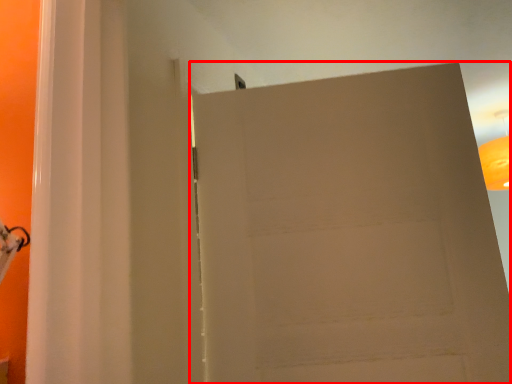
Question: Observing the image, what is the correct spatial positioning of door (annotated by the red box) in reference to lamp?

Choices:
 (A) left
 (B) right

Answer: (A)